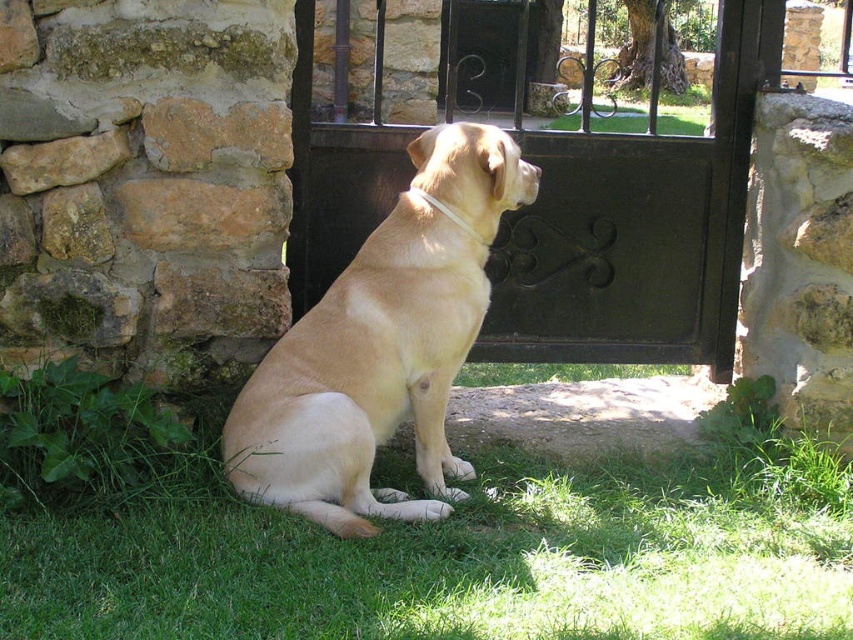
You are standing at the camera position and want to throw a ball to a point that is 4 meters away from you. Is the point at coordinates (550, 326) within the desired distance?

The point at coordinates (550, 326) is 4.30 meters away from the camera, which is slightly beyond the 4 meters desired. Therefore, it is not within the desired distance.

You are a delivery person trying to pass through the black wrought iron gate at center while carrying a large package. The golden fur dog at center is sitting near the gate. Can the dog fit through the gate without moving aside?

The black wrought iron gate at center is wider than the golden fur dog at center, so the dog can easily pass through the gate without needing to move aside.

You are a photographer trying to capture the golden fur dog at center and the green grass at lower center in the same frame. Based on their positions, which object is closer to the right edge of the image?

The green grass at lower center is to the right of the golden fur dog at center, so the green grass at lower center is closer to the right edge of the image.